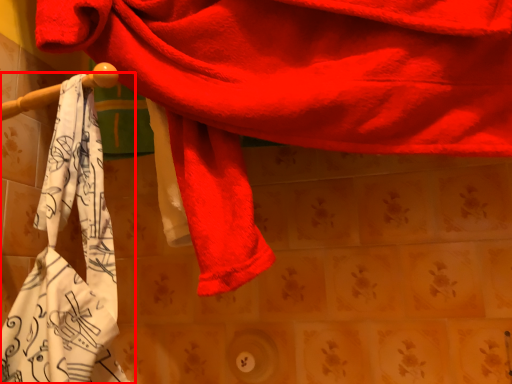
Question: From the image's perspective, considering the relative positions of towel (annotated by the red box) and towel in the image provided, where is towel (annotated by the red box) located with respect to the staircase?

Choices:
 (A) below
 (B) above

Answer: (A)